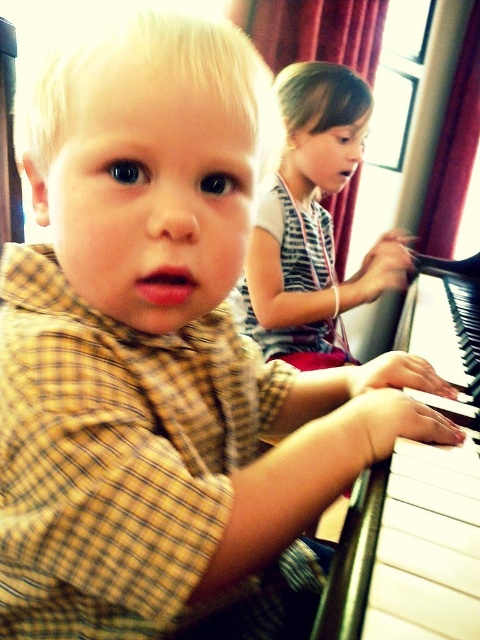
Between white glossy piano at right and striped fabric shirt at upper center, which one appears on the left side from the viewer's perspective?

From the viewer's perspective, striped fabric shirt at upper center appears more on the left side.

Based on the photo, who is higher up, white glossy piano at right or striped fabric shirt at upper center?

striped fabric shirt at upper center is higher up.

Which is in front, point (451, 355) or point (291, 182)?

Point (451, 355) is more forward.

At what (x,y) coordinates should I click in order to perform the action: click on white glossy piano at right. Please return your answer as a coordinate pair (x, y). This screenshot has width=480, height=640. Looking at the image, I should click on (419, 492).